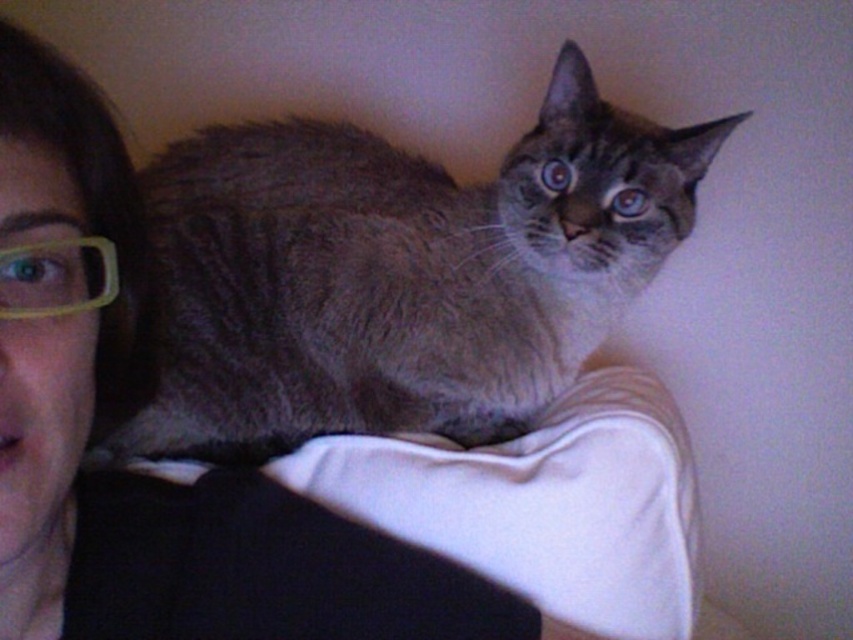
You are a photographer trying to adjust the lighting for a portrait. You notice the gray fur cat at center and the yellow plastic glasses at left in the frame. Which object is closer to the camera?

The gray fur cat at center is closer to the camera because the yellow plastic glasses at left is behind it.

You are a photographer trying to focus on the gray fur cat at center in the image. The camera has a focus point at coordinates point [398,273]. Is the focus point correctly positioned on the gray fur cat at center?

Yes, the focus point at point [398,273] is correctly positioned on the gray fur cat at center as indicated by the description.